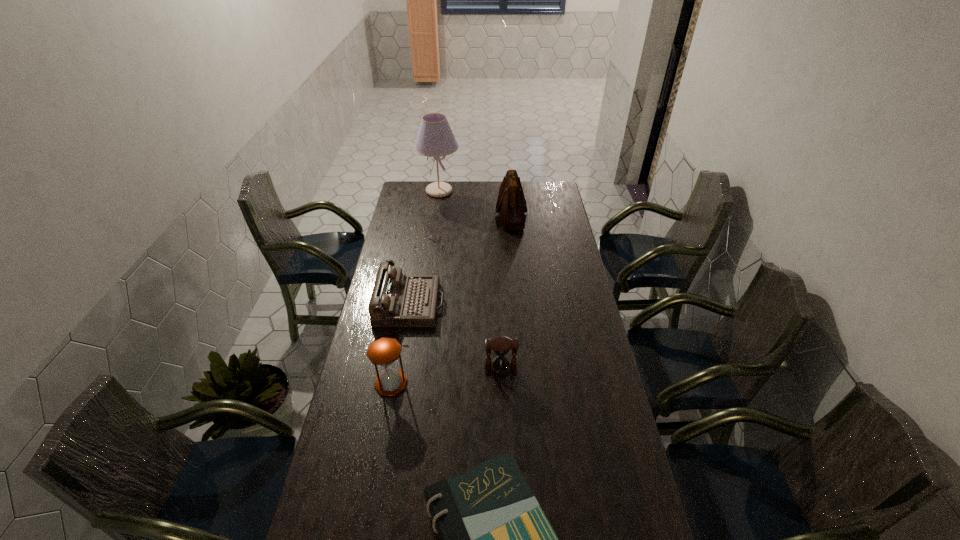
You are a GUI agent. You are given a task and a screenshot of the screen. Output one action in this format:
    pyautogui.click(x=<x>, y=<y>)
    Task: Click on the free space located 0.350m on the front of the shorter hourglass
    The width and height of the screenshot is (960, 540).
    Given the screenshot: What is the action you would take?
    pyautogui.click(x=505, y=474)

Locate an element on the screen. lampshade present at the far edge is located at coordinates point(435,138).

The width and height of the screenshot is (960, 540). I want to click on shoulder bag that is at the far edge, so click(x=511, y=204).

Identify the location of lampshade present at the left edge. This screenshot has height=540, width=960. (435, 138).

Identify the location of hourglass that is positioned at the left edge. (384, 351).

The image size is (960, 540). I want to click on typewriter that is at the left edge, so click(398, 300).

This screenshot has width=960, height=540. I want to click on object that is at the far left corner, so click(x=435, y=138).

At what (x,y) coordinates should I click in order to perform the action: click on free space at the far edge. Please return your answer as a coordinate pair (x, y). Image resolution: width=960 pixels, height=540 pixels. Looking at the image, I should click on (492, 195).

What are the coordinates of `vacant area at the left edge` in the screenshot? It's located at (397, 209).

At what (x,y) coordinates should I click in order to perform the action: click on free spot at the right edge of the desktop. Please return your answer as a coordinate pair (x, y). Looking at the image, I should click on 609,381.